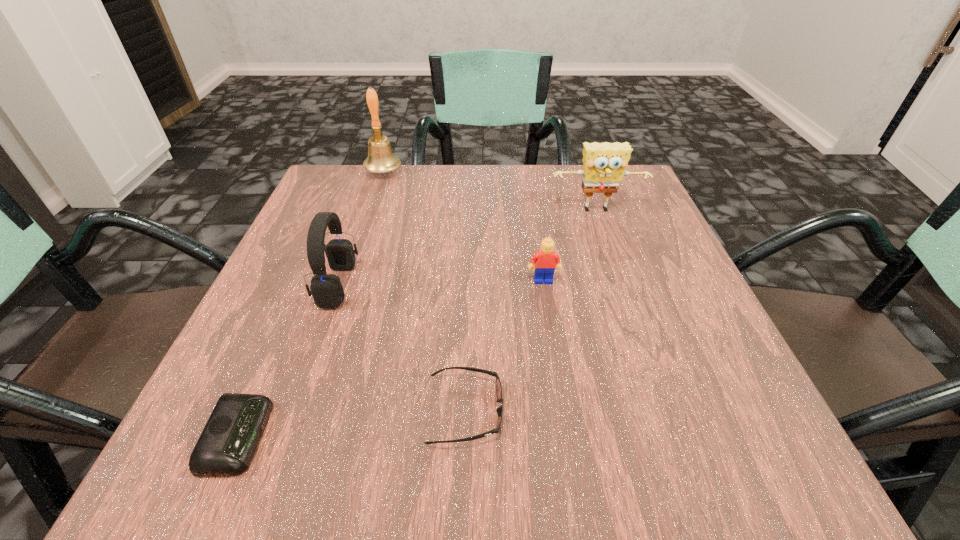
Identify the location of the farthest object. The image size is (960, 540). (380, 159).

Find the location of a particular element. the tallest object is located at coordinates (380, 159).

You are a GUI agent. You are given a task and a screenshot of the screen. Output one action in this format:
    pyautogui.click(x=<x>, y=<y>)
    Task: Click on the rightmost object
    The width and height of the screenshot is (960, 540).
    Given the screenshot: What is the action you would take?
    pyautogui.click(x=604, y=164)

I want to click on sponge, so click(604, 164).

Where is `headset`? This screenshot has height=540, width=960. headset is located at coordinates (327, 291).

Where is `the fourth tallest object`? the fourth tallest object is located at coordinates (546, 260).

The height and width of the screenshot is (540, 960). What are the coordinates of `the second object from right to left` in the screenshot? It's located at (546, 260).

The width and height of the screenshot is (960, 540). In order to click on sunglasses in this screenshot , I will do `click(498, 387)`.

I want to click on alarm clock, so click(x=229, y=440).

This screenshot has height=540, width=960. Find the location of `vacant region located on the front of the farthest object`. vacant region located on the front of the farthest object is located at coordinates (355, 259).